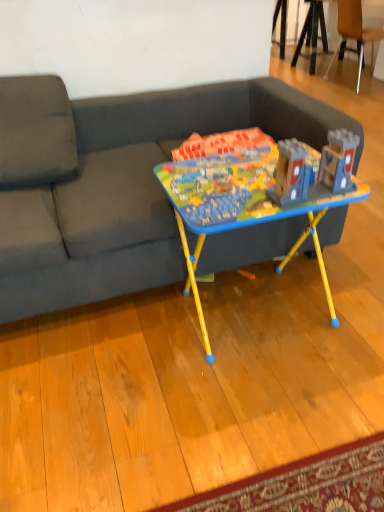
Question: Is wooden at upper right further to camera compared to dark gray fabric couch at center?

Choices:
 (A) no
 (B) yes

Answer: (B)

Question: Is wooden at upper right closer to camera compared to dark gray fabric couch at center?

Choices:
 (A) no
 (B) yes

Answer: (A)

Question: From the image's perspective, does wooden at upper right appear higher than dark gray fabric couch at center?

Choices:
 (A) no
 (B) yes

Answer: (B)

Question: Is wooden at upper right outside of dark gray fabric couch at center?

Choices:
 (A) no
 (B) yes

Answer: (B)

Question: Is wooden at upper right with dark gray fabric couch at center?

Choices:
 (A) no
 (B) yes

Answer: (A)

Question: Is point (380, 34) positioned closer to the camera than point (284, 209)?

Choices:
 (A) farther
 (B) closer

Answer: (A)

Question: From a real-world perspective, is wooden at upper right positioned above or below matte plastic table at center?

Choices:
 (A) below
 (B) above

Answer: (B)

Question: Relative to matte plastic table at center, is wooden at upper right in front or behind?

Choices:
 (A) front
 (B) behind

Answer: (B)

Question: Looking at the image, does wooden at upper right seem bigger or smaller compared to matte plastic table at center?

Choices:
 (A) big
 (B) small

Answer: (A)

Question: Choose the correct answer: Is dark gray fabric couch at center inside matte plastic table at center or outside it?

Choices:
 (A) outside
 (B) inside

Answer: (A)

Question: From the image's perspective, is dark gray fabric couch at center positioned above or below matte plastic table at center?

Choices:
 (A) above
 (B) below

Answer: (A)

Question: In terms of width, does dark gray fabric couch at center look wider or thinner when compared to matte plastic table at center?

Choices:
 (A) wide
 (B) thin

Answer: (A)

Question: From a real-world perspective, is dark gray fabric couch at center positioned above or below matte plastic table at center?

Choices:
 (A) below
 (B) above

Answer: (B)

Question: In terms of size, does wooden at upper right appear bigger or smaller than dark gray fabric couch at center?

Choices:
 (A) small
 (B) big

Answer: (A)

Question: Is wooden at upper right in front of or behind dark gray fabric couch at center in the image?

Choices:
 (A) behind
 (B) front

Answer: (A)